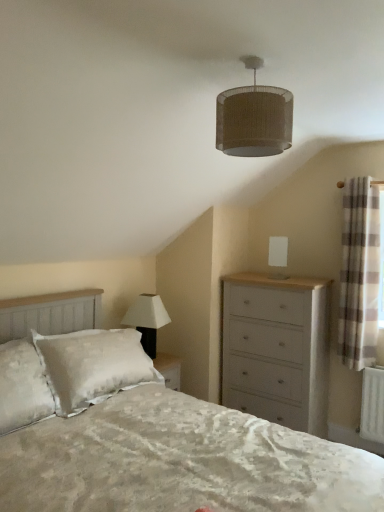
Question: From the image's perspective, is white painted wood chest of drawers at right on top of white matte lamp at upper center, marked as the 1th lamp in a left-to-right arrangement?

Choices:
 (A) no
 (B) yes

Answer: (A)

Question: Does white painted wood chest of drawers at right lie behind white matte lamp at upper center, the 3th lamp in the top-to-bottom sequence?

Choices:
 (A) yes
 (B) no

Answer: (B)

Question: Would you say white painted wood chest of drawers at right contains white matte lamp at upper center, the 3th lamp in the top-to-bottom sequence?

Choices:
 (A) yes
 (B) no

Answer: (B)

Question: From a real-world perspective, is white painted wood chest of drawers at right under white matte lamp at upper center, positioned as the 1th lamp in bottom-to-top order?

Choices:
 (A) no
 (B) yes

Answer: (B)

Question: Is white painted wood chest of drawers at right aimed at white matte lamp at upper center, marked as the 1th lamp in a left-to-right arrangement?

Choices:
 (A) yes
 (B) no

Answer: (B)

Question: Does white painted wood chest of drawers at right have a larger size compared to white matte lamp at upper center, the 2th lamp in the front-to-back sequence?

Choices:
 (A) no
 (B) yes

Answer: (B)

Question: From a real-world perspective, is white matte lamp at upper center, marked as the 1th lamp in a left-to-right arrangement, physically below plaid fabric curtain at right?

Choices:
 (A) no
 (B) yes

Answer: (B)

Question: Is white matte lamp at upper center, acting as the second lamp starting from the back, directly adjacent to plaid fabric curtain at right?

Choices:
 (A) yes
 (B) no

Answer: (B)

Question: Does white matte lamp at upper center, acting as the second lamp starting from the back, have a greater height compared to plaid fabric curtain at right?

Choices:
 (A) no
 (B) yes

Answer: (A)

Question: Is the position of white matte lamp at upper center, which is the 3th lamp from right to left, more distant than that of plaid fabric curtain at right?

Choices:
 (A) no
 (B) yes

Answer: (B)

Question: From the image's perspective, would you say white matte lamp at upper center, marked as the 1th lamp in a left-to-right arrangement, is shown under plaid fabric curtain at right?

Choices:
 (A) yes
 (B) no

Answer: (A)

Question: Does white matte lamp at upper center, acting as the second lamp starting from the back, have a lesser width compared to plaid fabric curtain at right?

Choices:
 (A) yes
 (B) no

Answer: (B)

Question: Is white matte lampshade at upper center, the 2th lamp in the bottom-to-top sequence, closer to the viewer compared to plaid fabric curtain at right?

Choices:
 (A) yes
 (B) no

Answer: (A)